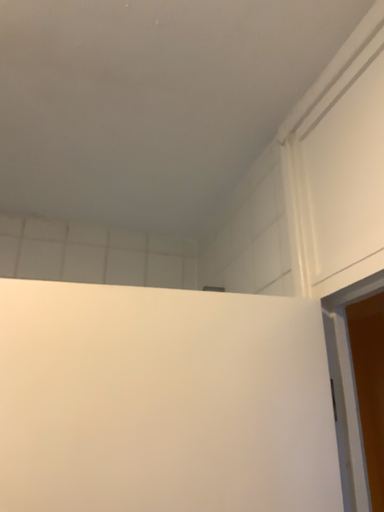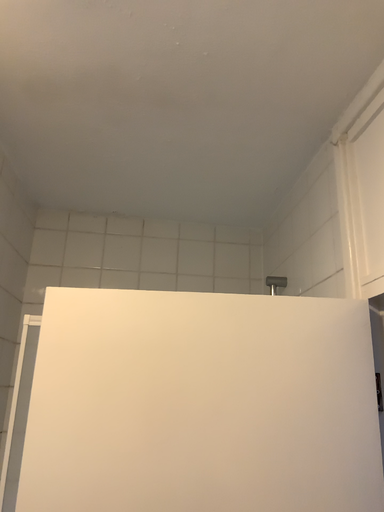
Question: How did the camera likely rotate when shooting the video?

Choices:
 (A) rotated left
 (B) rotated right

Answer: (A)